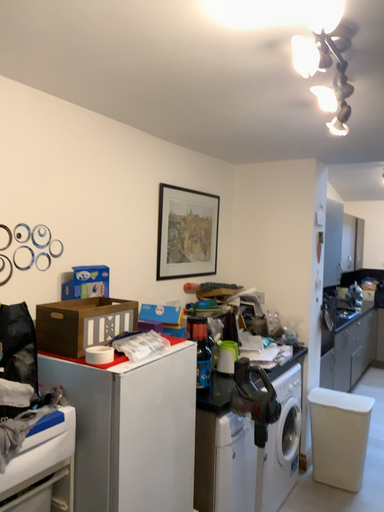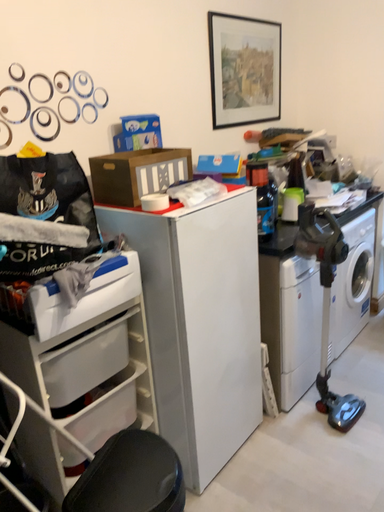
Question: How did the camera likely rotate when shooting the video?

Choices:
 (A) rotated downward
 (B) rotated upward

Answer: (A)